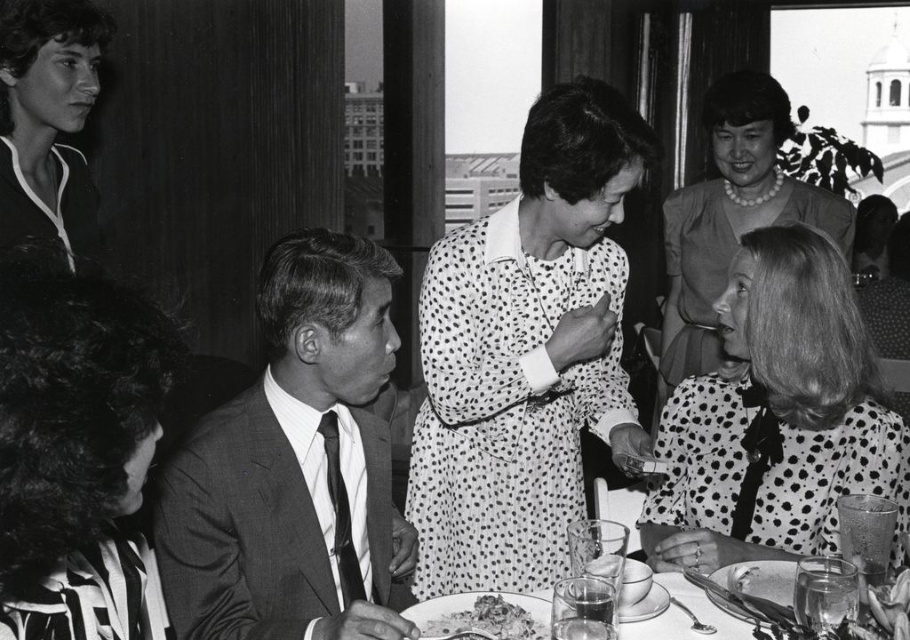
In the image, there is a striped fabric blouse at lower left. Where exactly is it located in terms of coordinates?

The striped fabric blouse at lower left is located at coordinates point (76, 451).

You are standing at the position of point (x=99, y=618) and want to see the person behind point (x=245, y=484). Can you see them clearly?

No, because point (x=245, y=484) is further to the camera than point (x=99, y=618), so the person behind point (x=245, y=484) would be obscured by the foreground objects closer to you.

You are at a formal event and notice a point marked at coordinates (76, 451). Based on the scene description, what object or part of an object is this point likely indicating?

The point at coordinates (76, 451) is on the striped fabric blouse at lower left.